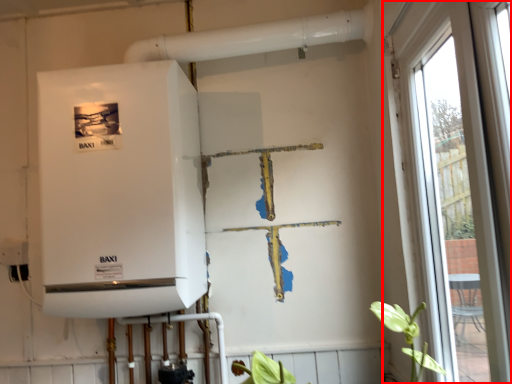
Question: From the image's perspective, what is the correct spatial relationship of window (annotated by the red box) in relation to appliance?

Choices:
 (A) above
 (B) below

Answer: (B)